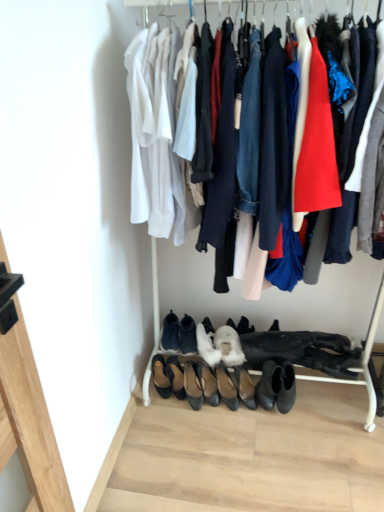
Question: Does suede black shoes at center, arranged as the 6th footwear when viewed from the right, come behind leather black shoes at center, acting as the second footwear starting from the left?

Choices:
 (A) no
 (B) yes

Answer: (A)

Question: Are suede black shoes at center, arranged as the 6th footwear when viewed from the right, and leather black shoes at center, acting as the second footwear starting from the left, far apart?

Choices:
 (A) no
 (B) yes

Answer: (A)

Question: From a real-world perspective, is suede black shoes at center, arranged as the 6th footwear when viewed from the right, over leather black shoes at center, the 8th footwear when ordered from right to left?

Choices:
 (A) no
 (B) yes

Answer: (B)

Question: Is suede black shoes at center, arranged as the 4th footwear when viewed from the left, smaller than leather black shoes at center, acting as the second footwear starting from the left?

Choices:
 (A) yes
 (B) no

Answer: (A)

Question: Considering the relative sizes of suede black shoes at center, arranged as the 6th footwear when viewed from the right, and leather black shoes at center, the 8th footwear when ordered from right to left, in the image provided, is suede black shoes at center, arranged as the 6th footwear when viewed from the right, bigger than leather black shoes at center, the 8th footwear when ordered from right to left,?

Choices:
 (A) no
 (B) yes

Answer: (A)

Question: Does suede black shoes at center, arranged as the 6th footwear when viewed from the right, appear on the right side of leather black shoes at center, acting as the second footwear starting from the left?

Choices:
 (A) yes
 (B) no

Answer: (A)

Question: Is the depth of black leather shoes at lower center, the 9th footwear in the left-to-right sequence, greater than that of black leather shoes at lower center, the seventh footwear viewed from the right?

Choices:
 (A) yes
 (B) no

Answer: (B)

Question: Is black leather shoes at lower center, the 9th footwear in the left-to-right sequence, bigger than black leather shoes at lower center, the seventh footwear viewed from the right?

Choices:
 (A) yes
 (B) no

Answer: (A)

Question: Is black leather shoes at lower center, the 9th footwear in the left-to-right sequence, at the right side of black leather shoes at lower center, the seventh footwear viewed from the right?

Choices:
 (A) yes
 (B) no

Answer: (A)

Question: Is black leather shoes at lower center, positioned as the 3th footwear in left-to-right order, located within black leather shoes at lower center, the first footwear from the right?

Choices:
 (A) yes
 (B) no

Answer: (B)

Question: Considering the relative sizes of black leather shoes at lower center, the first footwear from the right, and black leather shoes at lower center, positioned as the 3th footwear in left-to-right order, in the image provided, is black leather shoes at lower center, the first footwear from the right, thinner than black leather shoes at lower center, positioned as the 3th footwear in left-to-right order,?

Choices:
 (A) no
 (B) yes

Answer: (A)

Question: From a real-world perspective, is black leather shoes at lower center, the 9th footwear in the left-to-right sequence, on black leather shoes at lower center, the seventh footwear viewed from the right?

Choices:
 (A) yes
 (B) no

Answer: (B)

Question: Considering the relative sizes of brown leather shoe at lower left, the first footwear from the left, and black leather flats at center, the 5th footwear in the right-to-left sequence, in the image provided, is brown leather shoe at lower left, the first footwear from the left, thinner than black leather flats at center, the 5th footwear in the right-to-left sequence,?

Choices:
 (A) no
 (B) yes

Answer: (B)